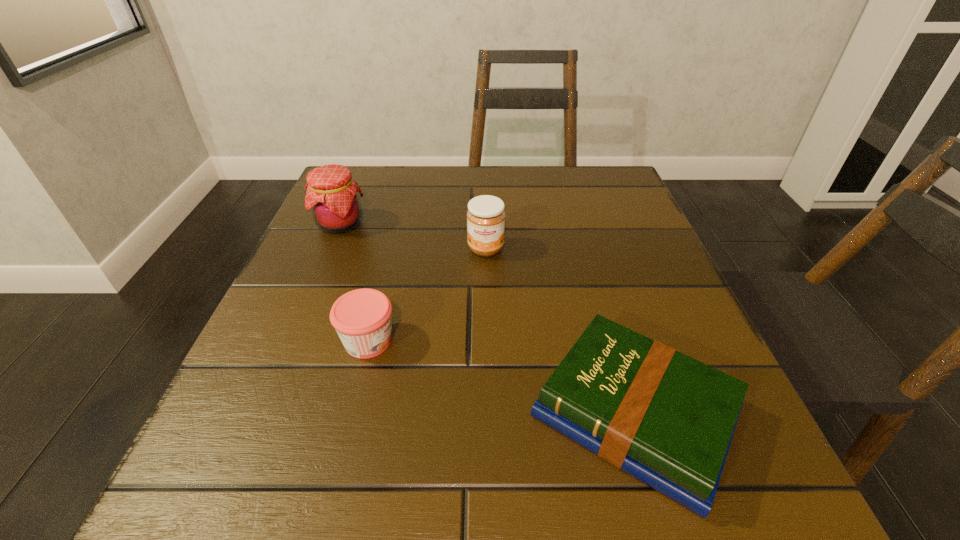
Find the location of a particular element. vacant space that's between the shortest object and the rightmost jam is located at coordinates (560, 331).

Where is `object that is the second closest one to the rightmost object`? The height and width of the screenshot is (540, 960). object that is the second closest one to the rightmost object is located at coordinates (362, 318).

This screenshot has height=540, width=960. Find the location of `object that stands as the third closest to the nearest jam`. object that stands as the third closest to the nearest jam is located at coordinates (332, 194).

Identify which jam is located as the second nearest to the leftmost object. Please provide its 2D coordinates. Your answer should be formatted as a tuple, i.e. [(x, y)], where the tuple contains the x and y coordinates of a point satisfying the conditions above.

[(362, 318)]

You are a GUI agent. You are given a task and a screenshot of the screen. Output one action in this format:
    pyautogui.click(x=<x>, y=<y>)
    Task: Click on the third closest jam relative to the shortest object
    Image resolution: width=960 pixels, height=540 pixels.
    Given the screenshot: What is the action you would take?
    pyautogui.click(x=332, y=194)

I want to click on free space that satisfies the following two spatial constraints: 1. on the front label of the second jam from right to left; 2. on the back side of the shortest object, so click(x=350, y=414).

Identify the location of free spot that satisfies the following two spatial constraints: 1. on the front label of the book; 2. on the left side of the third tallest object. The width and height of the screenshot is (960, 540). (350, 414).

The width and height of the screenshot is (960, 540). I want to click on vacant point that satisfies the following two spatial constraints: 1. on the front side of the shortest object; 2. on the right side of the leftmost object, so click(x=260, y=414).

You are a GUI agent. You are given a task and a screenshot of the screen. Output one action in this format:
    pyautogui.click(x=<x>, y=<y>)
    Task: Click on the vacant space that satisfies the following two spatial constraints: 1. on the back side of the rightmost object; 2. on the front label of the second jam from left to right
    The image size is (960, 540).
    Given the screenshot: What is the action you would take?
    pyautogui.click(x=613, y=341)